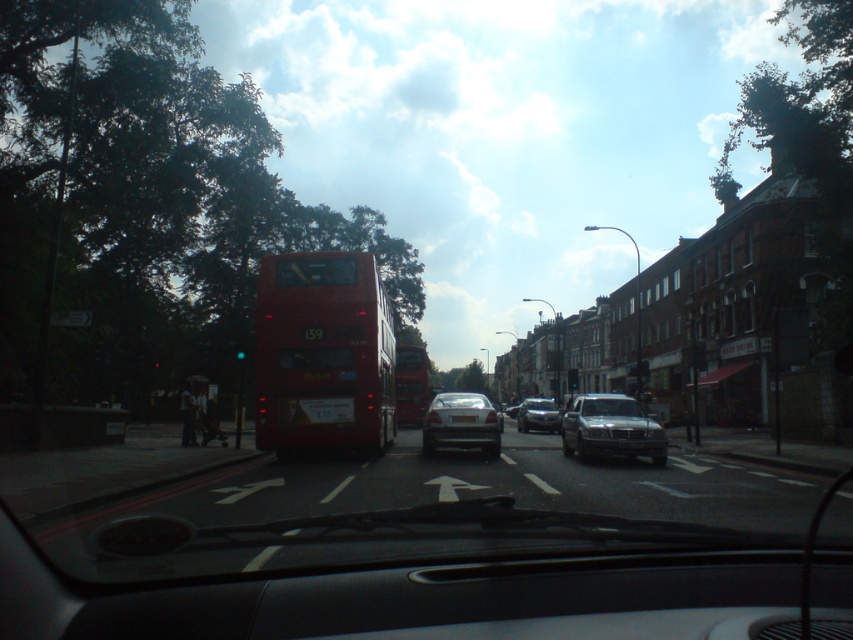
Is satin silver sedan at center positioned before silver metallic sedan at center?

That is True.

Is satin silver sedan at center positioned behind silver metallic sedan at center?

No, satin silver sedan at center is closer to the viewer.

Locate an element on the screen. satin silver sedan at center is located at coordinates coord(611,428).

Who is shorter, shiny red bus at center or red matte bus at center?

red matte bus at center is shorter.

Between point (373, 273) and point (401, 394), which one is positioned in front?

Point (373, 273)

You are a GUI agent. You are given a task and a screenshot of the screen. Output one action in this format:
    pyautogui.click(x=<x>, y=<y>)
    Task: Click on the shiny red bus at center
    The width and height of the screenshot is (853, 640).
    Given the screenshot: What is the action you would take?
    pyautogui.click(x=322, y=353)

Does shiny silver sedan at center have a larger size compared to white plastic license plate at center?

Indeed, shiny silver sedan at center has a larger size compared to white plastic license plate at center.

Image resolution: width=853 pixels, height=640 pixels. What do you see at coordinates (537, 416) in the screenshot?
I see `shiny silver sedan at center` at bounding box center [537, 416].

Find the location of a particular element. This screenshot has height=640, width=853. shiny silver sedan at center is located at coordinates (537, 416).